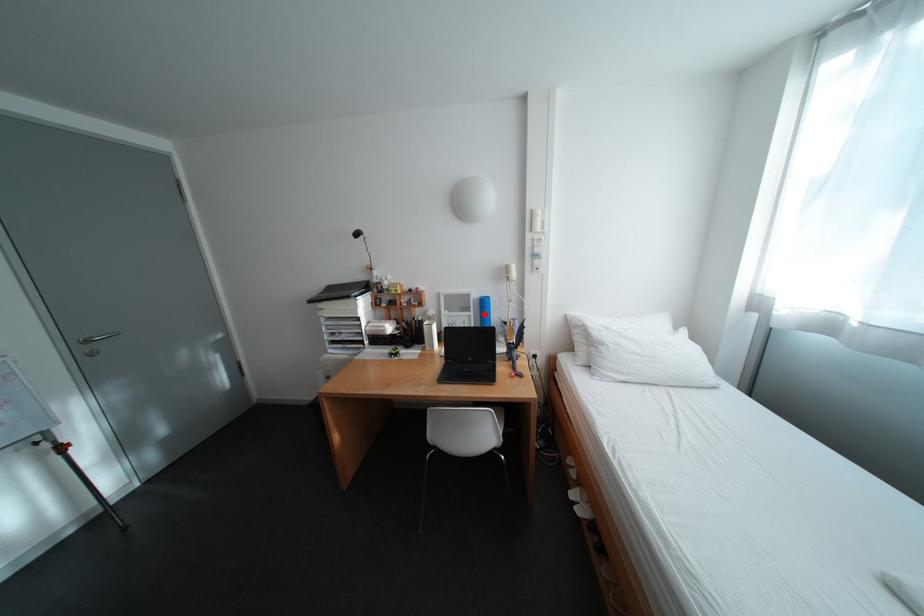
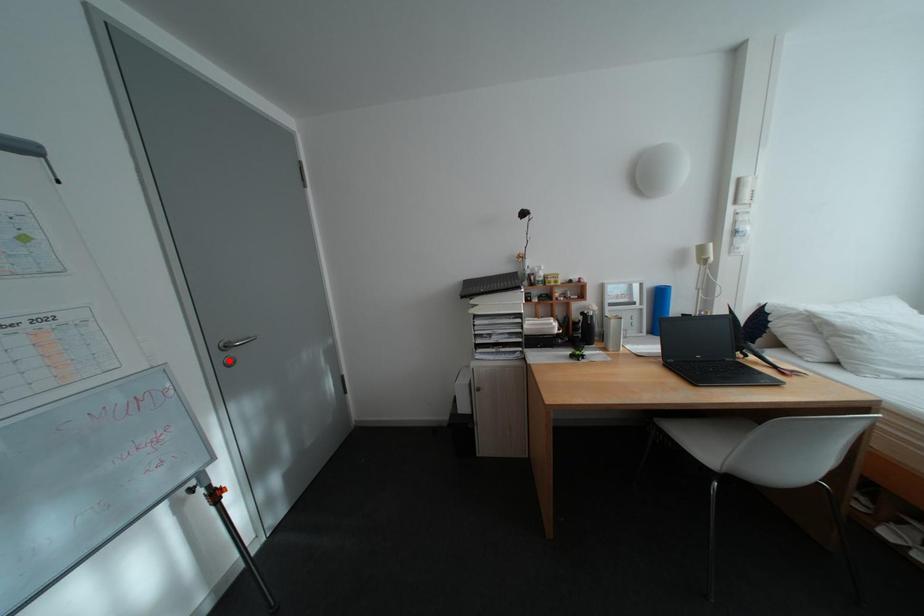
I am providing you with two images of the same scene from different viewpoints. A red point is marked on the first image and another point is marked on the second image. Do the highlighted points in image1 and image2 indicate the same real-world spot?

No